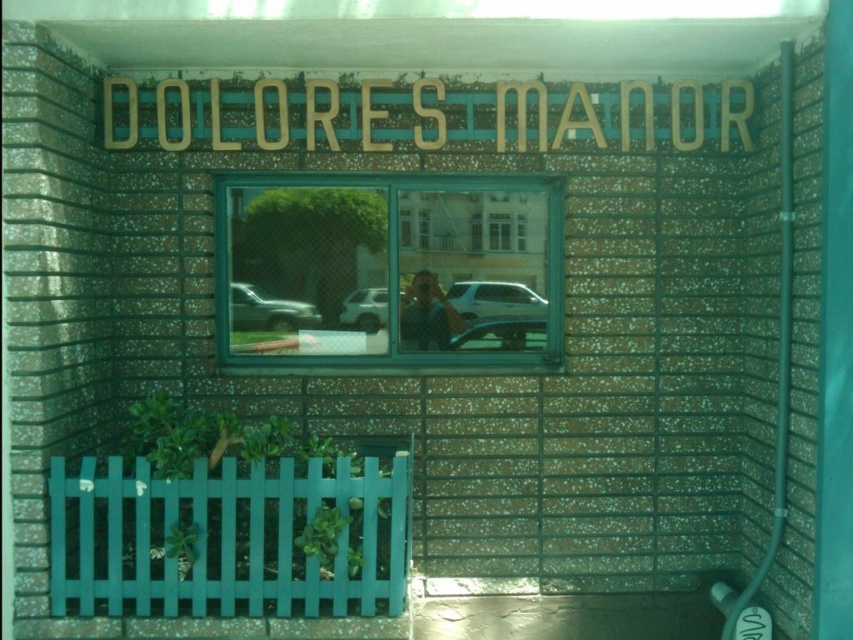
You are standing in front of Dolores Manor and want to take a photo of the window. You notice two points marked on your map at coordinates point (257,298) and point (498,225). Which point is closer to you, the photographer?

Point (257,298) is in front of point (498,225), so it is closer to you.